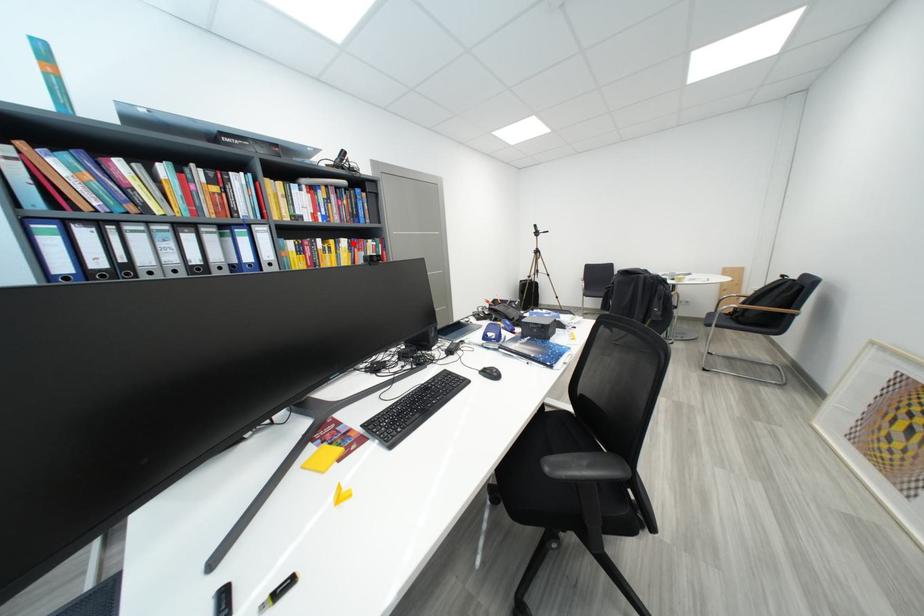
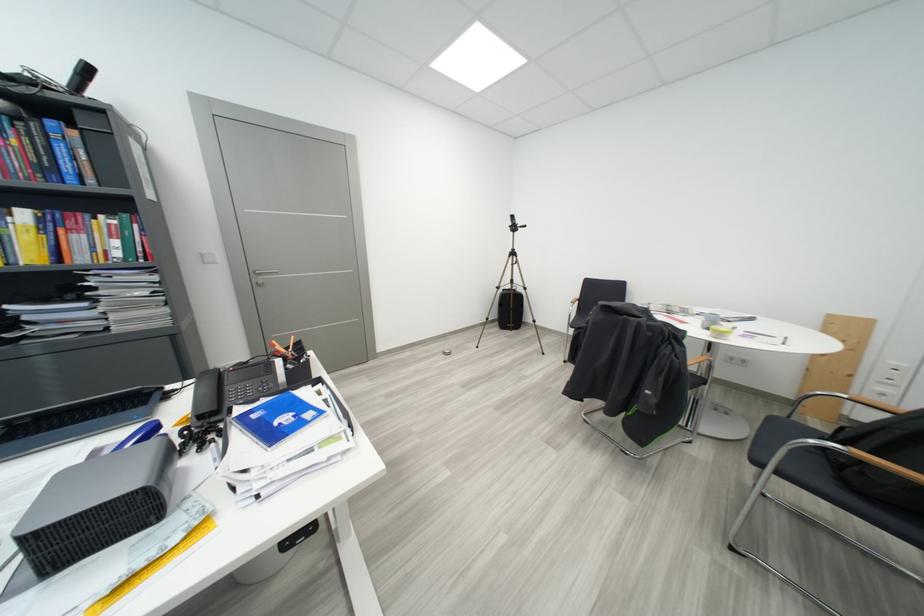
Question: I am providing you with two images of the same scene from different viewpoints. Image1 has a red point marked. In image2, the corresponding 3D location appears at what relative position? Reply with the corresponding letter.

Choices:
 (A) Closer
 (B) Farther

Answer: (B)